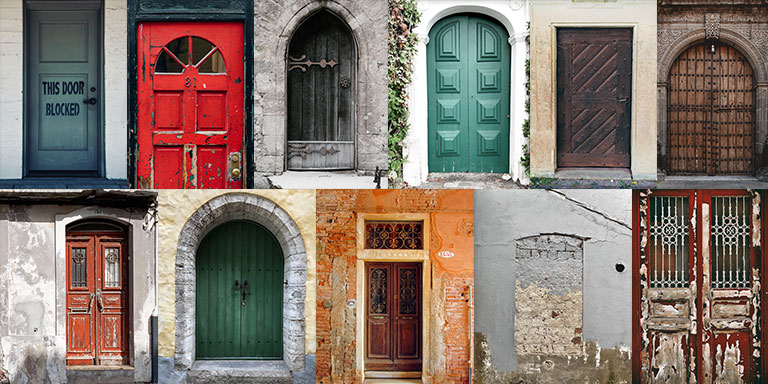
The width and height of the screenshot is (768, 384). Identify the location of double doors. (713, 339), (475, 128), (108, 317), (250, 313), (392, 335), (733, 149).